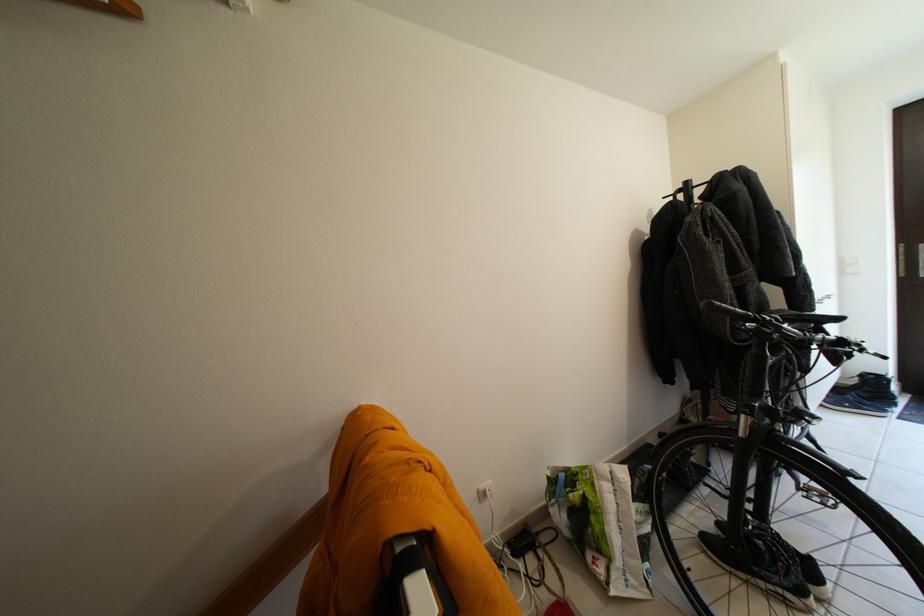
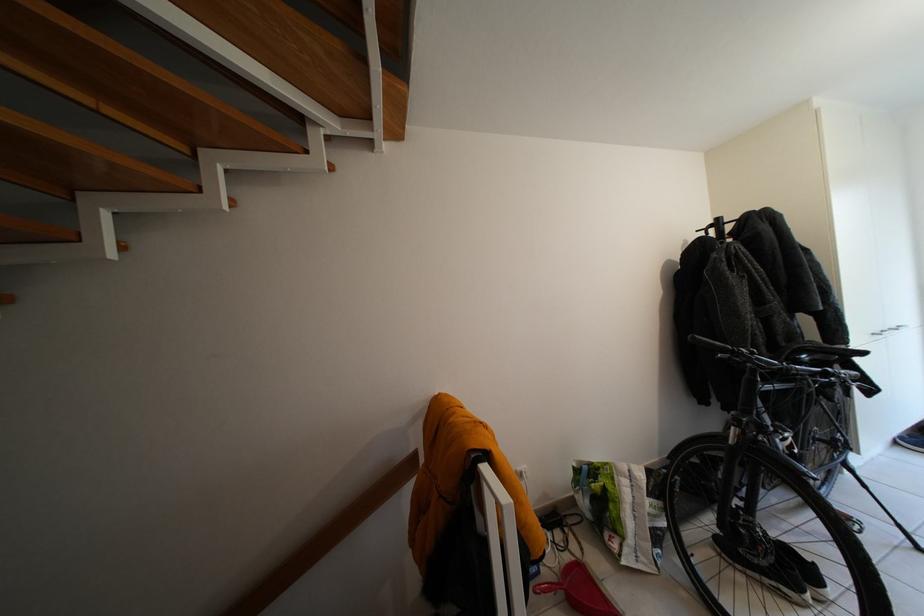
Locate, in the second image, the point that corresponds to pixel 549 559 in the first image.

(575, 535)